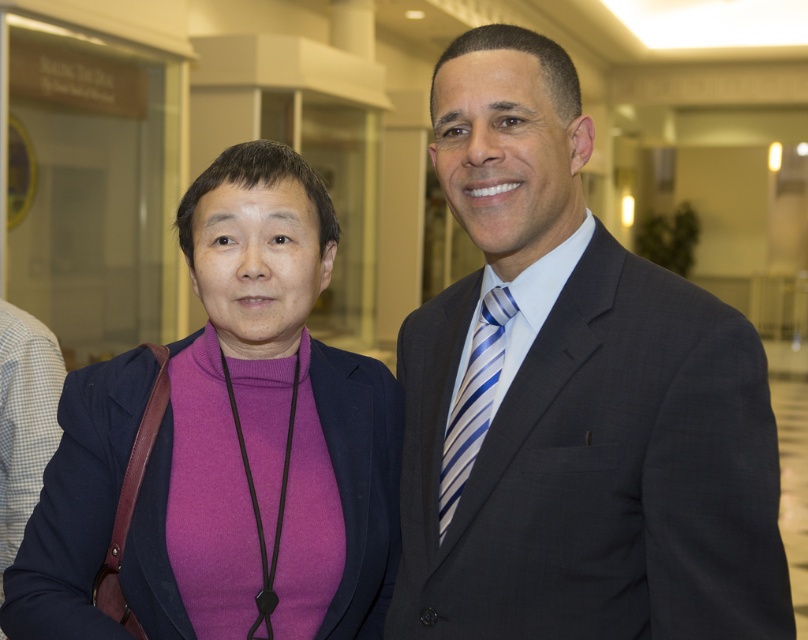
You are a photographer at a conference and need to ensure that both the purple matte sweater at center and the blue striped tie at center are visible in your photo. Based on their positions, which item might be partially obscured if you focus on the front subject?

The blue striped tie at center might be partially obscured because the purple matte sweater at center is in front of it.

You are organizing a photo shoot and need to place a small decorative item between the purple matte sweater at center and the blue striped tie at center. Considering their heights, which object should the item be placed closer to?

The purple matte sweater at center is much taller than the blue striped tie at center, so the decorative item should be placed closer to the blue striped tie at center to maintain visual balance.